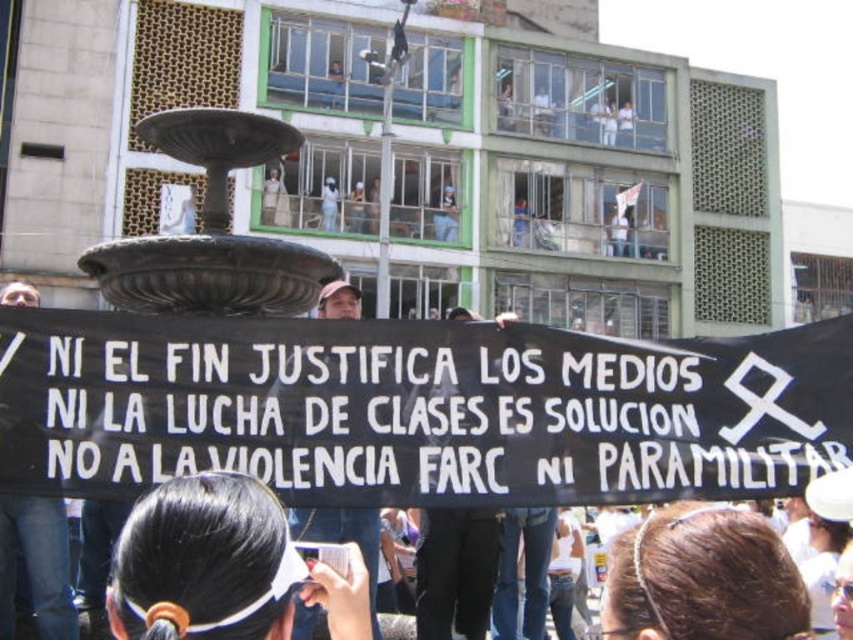
Between point (140, 513) and point (115, 259), which one is positioned behind?

The point (115, 259) is more distant.

Does black hair at center have a greater width compared to bronze textured fountain at center?

No.

You are a GUI agent. You are given a task and a screenshot of the screen. Output one action in this format:
    pyautogui.click(x=<x>, y=<y>)
    Task: Click on the black hair at center
    Image resolution: width=853 pixels, height=640 pixels.
    Given the screenshot: What is the action you would take?
    pyautogui.click(x=223, y=566)